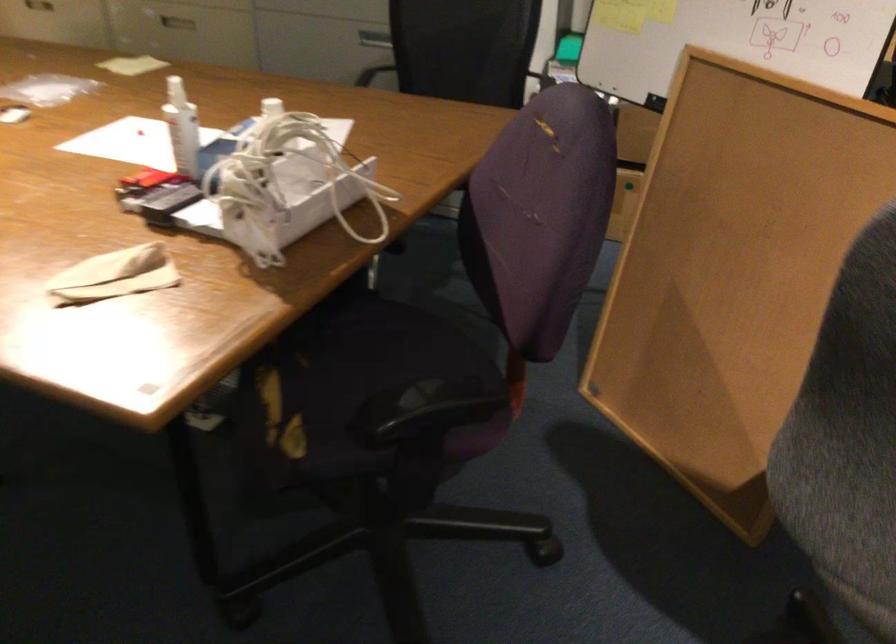
The height and width of the screenshot is (644, 896). Describe the element at coordinates (182, 128) in the screenshot. I see `a spray bottle nozzle` at that location.